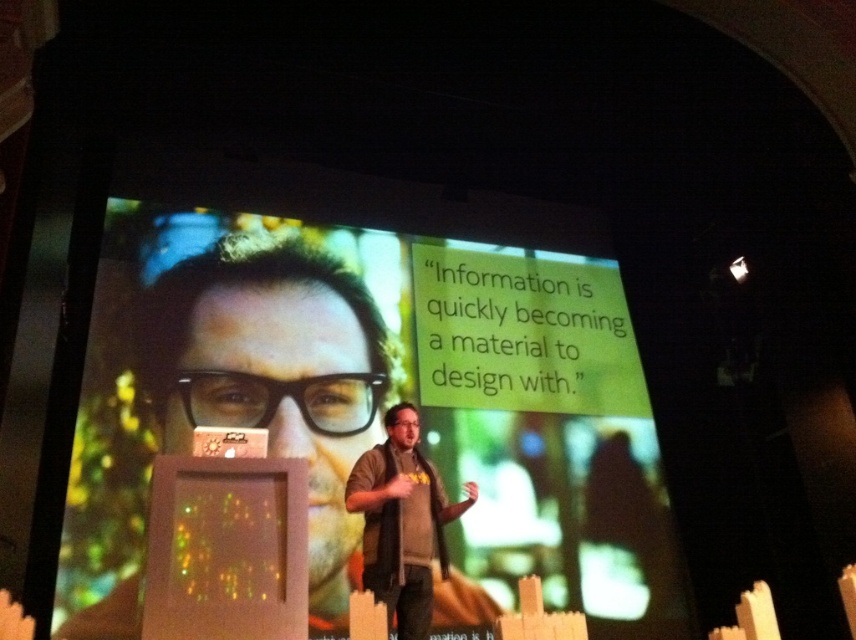
Is matte black screen at center taller than dark brown leather jacket at center?

Indeed, matte black screen at center has a greater height compared to dark brown leather jacket at center.

I want to click on matte black screen at center, so click(x=375, y=384).

Is point (85, 504) farther from camera compared to point (435, 545)?

No.

Where is `matte black screen at center`? matte black screen at center is located at coordinates click(375, 384).